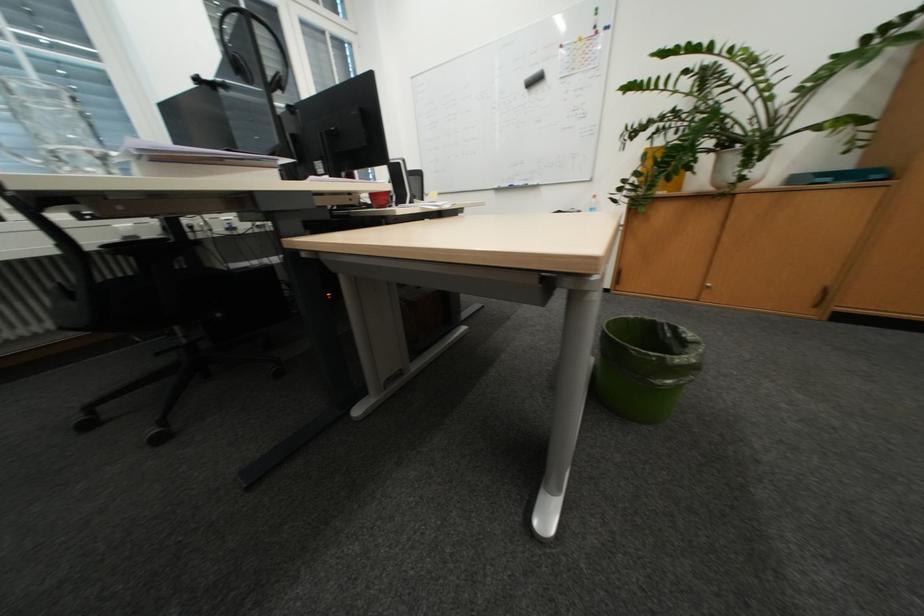
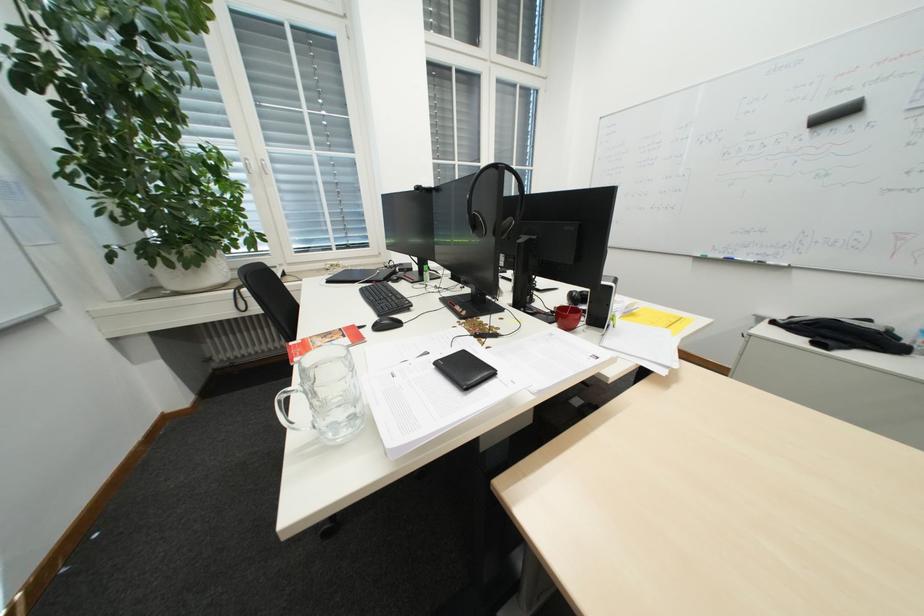
Question: The camera is either moving clockwise (left) or counter-clockwise (right) around the object. The first image is from the beginning of the video and the second image is from the end. Is the camera moving left or right when shooting the video?

Choices:
 (A) Left
 (B) Right

Answer: (B)